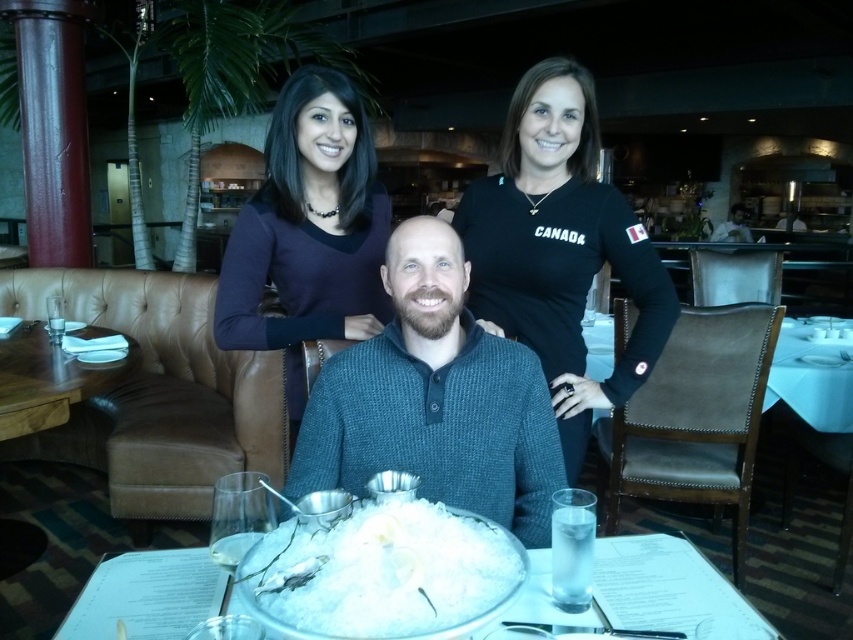
You are a waiter in this restaurant and need to place a drink order on the table. The customer is wearing a teal knitted sweater at center. Where should you place the drink so it is closest to the customer without being on top of their sweater? Use the coordinate system where the bottom left corner of the table is point 0,0 and the top right corner is 1,1. The customer is located at point (434, 400). Please provide the coordinates as a point in the format x,y.

The teal knitted sweater at center is located at point (434, 400). To place the drink closest to the customer without being on their sweater, the coordinates should be slightly offset from their position. The optimal point would be (434, 400) adjusted to avoid overlap, such as 0.6, 0.5.

You are a server in a restaurant and need to determine which item is easier to see through. The white ice at center and the smooth white shirt at center are both in front of you. Which one allows more light to pass through?

The white ice at center is thinner than the smooth white shirt at center, so it allows more light to pass through and is easier to see through.